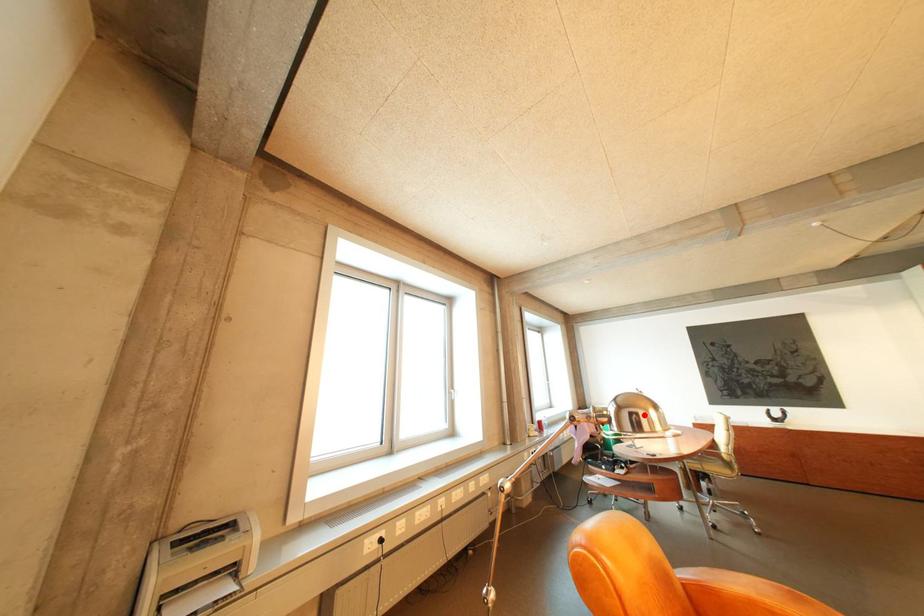
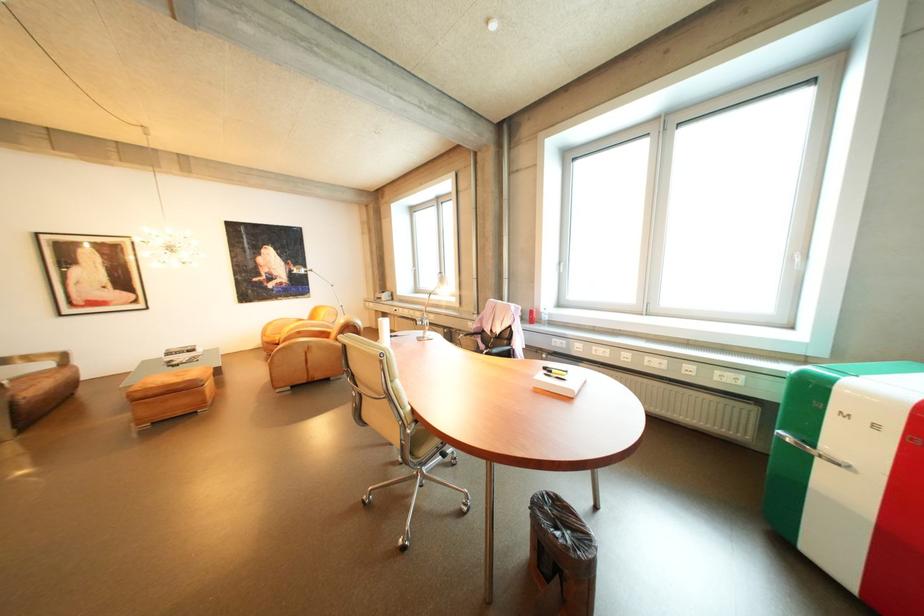
Question: I am providing you with two images of the same scene from different viewpoints. A red point is marked on the first image. Is the red point's position out of view in image 2?

Choices:
 (A) Yes
 (B) No

Answer: (A)